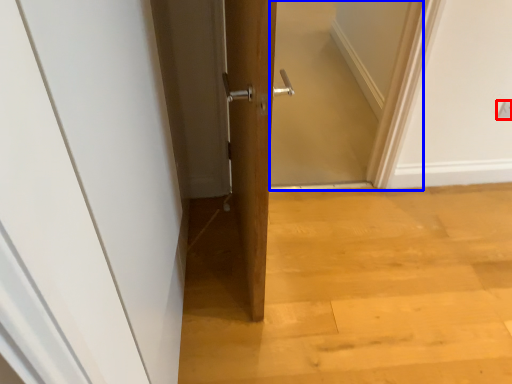
Question: Which of the following is the closest to the observer, electric outlet (highlighted by a red box) or screen door (highlighted by a blue box)?

Choices:
 (A) electric outlet
 (B) screen door

Answer: (B)